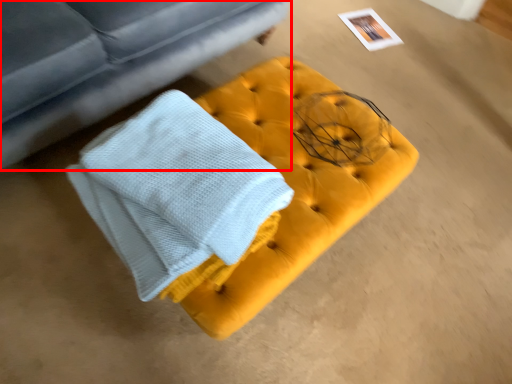
Question: Where is studio couch (annotated by the red box) located in relation to furniture in the image?

Choices:
 (A) right
 (B) left

Answer: (B)